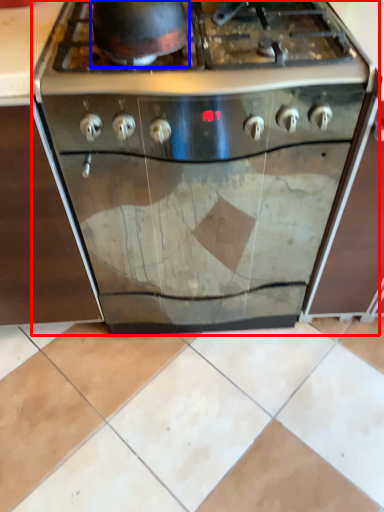
Question: Which object is further to the camera taking this photo, kitchen appliance (highlighted by a red box) or wok (highlighted by a blue box)?

Choices:
 (A) kitchen appliance
 (B) wok

Answer: (A)